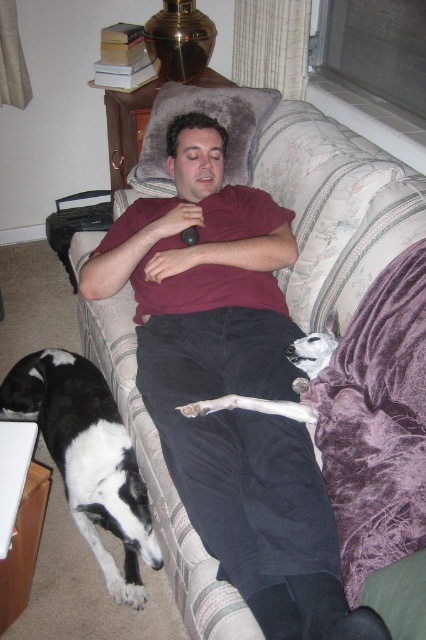
You are a photographer trying to capture a photo of the black and white fur at lower left and the white fur dog at lower right. Which dog should you focus on first if you want to ensure both are in focus without adjusting your camera settings?

The black and white fur at lower left is taller than the white fur dog at lower right. Since the taller dog is closer to the camera, you should focus on the black and white fur at lower left first to ensure both are in focus.